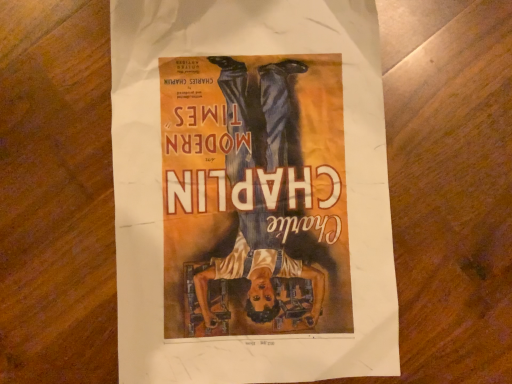
Question: Should I look upward or downward to see matte paper poster at center?

Choices:
 (A) down
 (B) up

Answer: (B)